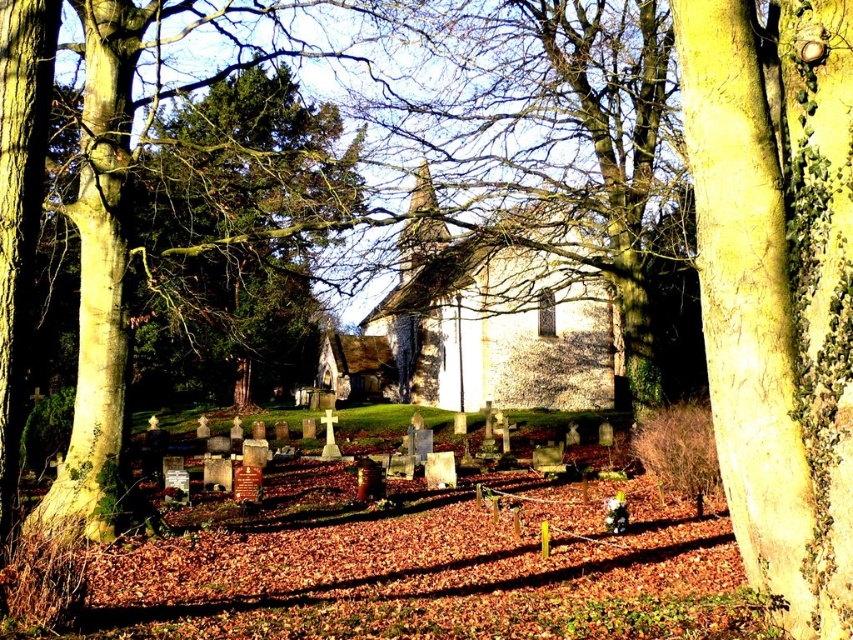
Which of these two, green rough bark tree at right or smooth bark tree at center, stands shorter?

green rough bark tree at right

Between green rough bark tree at right and smooth bark tree at center, which one appears on the right side from the viewer's perspective?

Positioned to the right is smooth bark tree at center.

Identify the location of green rough bark tree at right. This screenshot has height=640, width=853. (776, 289).